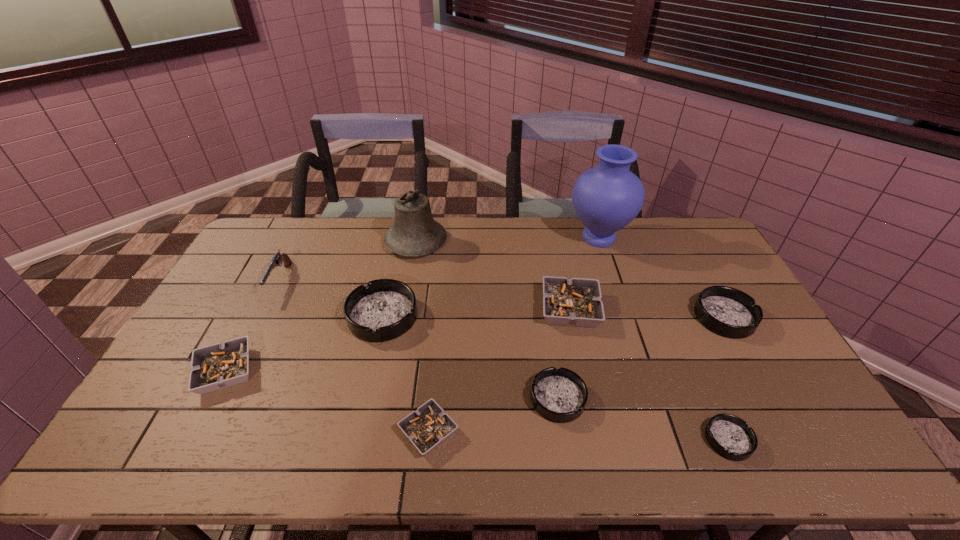
At what (x,y) coordinates should I click in order to perform the action: click on the leftmost ashtray. Please return your answer as a coordinate pair (x, y). Looking at the image, I should click on (217, 366).

The height and width of the screenshot is (540, 960). What are the coordinates of `the second smallest dark ashtray` in the screenshot? It's located at (559, 395).

In order to click on the smallest gray ashtray in this screenshot , I will do (x=427, y=427).

I want to click on the nearest gray ashtray, so click(x=427, y=427).

In order to click on the second ashtray from right to left in this screenshot , I will do `click(728, 435)`.

Image resolution: width=960 pixels, height=540 pixels. What are the coordinates of `the second dark ashtray from right to left` in the screenshot? It's located at (728, 435).

The height and width of the screenshot is (540, 960). Identify the location of vacant space located on the front of the tallest object. (611, 275).

Locate an element on the screen. The width and height of the screenshot is (960, 540). free location located 0.180m on the left of the ninth shortest object is located at coordinates (337, 242).

Where is `free location located 0.340m aiming along the barrel of the third tallest object`? Image resolution: width=960 pixels, height=540 pixels. free location located 0.340m aiming along the barrel of the third tallest object is located at coordinates (224, 394).

In order to click on free space located on the back of the leftmost dark ashtray in this screenshot , I will do [x=398, y=244].